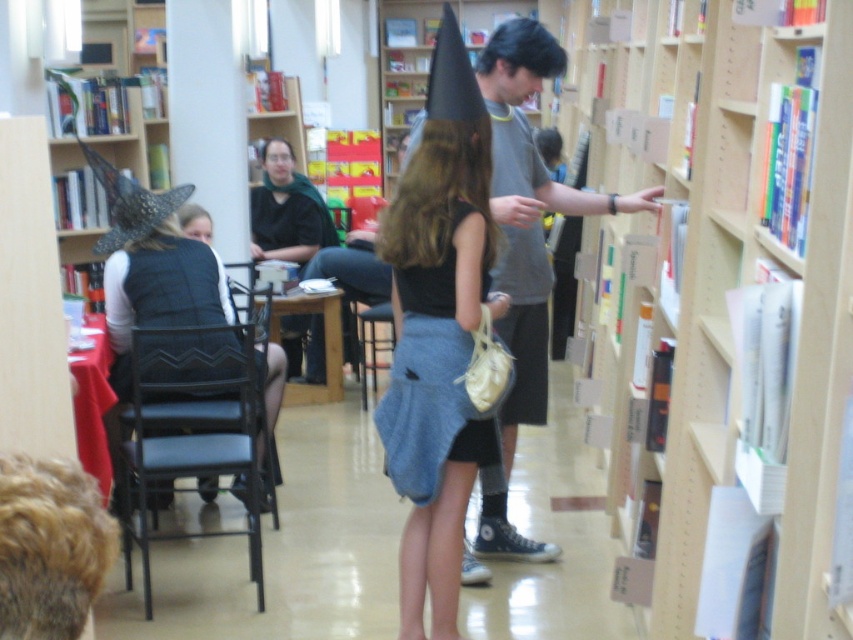
You are a delivery person who needs to place a 24 inch wide package between the wooden bookshelf at left and the matte black shirt at center. Is there enough space?

The wooden bookshelf at left and matte black shirt at center are 26.69 inches apart from each other. Since the package is 24 inches wide, there is enough space to place it between them.

You are standing at the entrance of the bookstore and want to quickly locate the wooden bookshelf at left. Based on the coordinates provided, in which general direction should you look to find it?

The wooden bookshelf at left is located at coordinates point (105, 138), which means it is positioned to the left and slightly forward from your current position at the entrance.